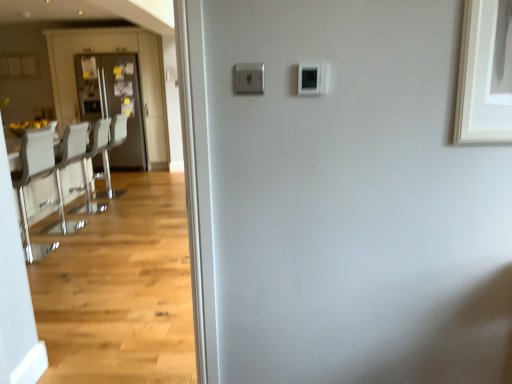
At what (x,y) coordinates should I click in order to perform the action: click on free region under white glossy chair at left (from a real-world perspective). Please return your answer as a coordinate pair (x, y). The width and height of the screenshot is (512, 384). Looking at the image, I should click on (46, 248).